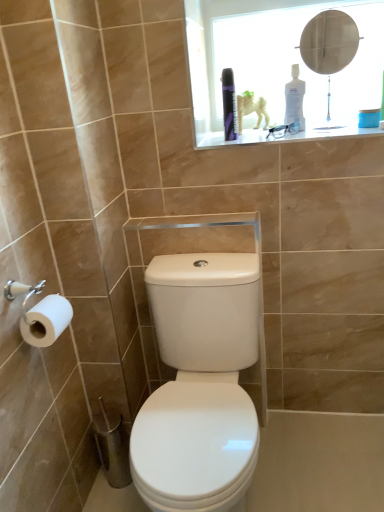
You are a GUI agent. You are given a task and a screenshot of the screen. Output one action in this format:
    pyautogui.click(x=<x>, y=<y>)
    Task: Click on the free point to the right of purple glossy can at upper center, which appears as the 2th toiletry when viewed from the right
    The height and width of the screenshot is (512, 384).
    Given the screenshot: What is the action you would take?
    pyautogui.click(x=287, y=134)